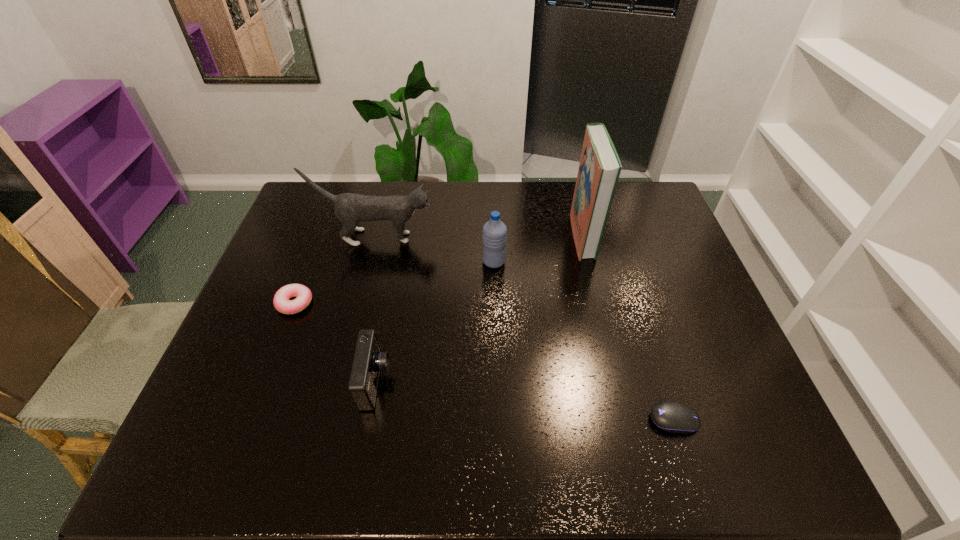
Find the location of a particular element. object located at the right edge is located at coordinates (673, 417).

Locate an element on the screen. The height and width of the screenshot is (540, 960). object that is at the near right corner is located at coordinates (673, 417).

Locate an element on the screen. The height and width of the screenshot is (540, 960). vacant space at the near edge of the desktop is located at coordinates (370, 469).

What are the coordinates of `vacant space at the left edge of the desktop` in the screenshot? It's located at (318, 272).

Identify the location of vacant space at the right edge. [715, 321].

I want to click on vacant space at the far left corner of the desktop, so click(x=299, y=222).

Locate an element on the screen. free space at the near left corner of the desktop is located at coordinates (229, 475).

This screenshot has height=540, width=960. In order to click on vacant space at the near right corner in this screenshot , I will do `click(752, 453)`.

Identify the location of empty space that is in between the rightmost object and the second tallest object. click(x=525, y=328).

You are a GUI agent. You are given a task and a screenshot of the screen. Output one action in this format:
    pyautogui.click(x=<x>, y=<y>)
    Task: Click on the free space that is in between the tallest object and the fourth farthest object
    
    Given the screenshot: What is the action you would take?
    pyautogui.click(x=439, y=269)